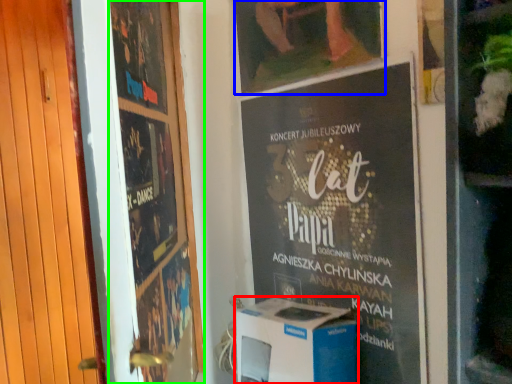
Question: Which object is positioned closest to appliance (highlighted by a red box)? Select from picture frame (highlighted by a blue box) and poster (highlighted by a green box).

Choices:
 (A) picture frame
 (B) poster

Answer: (B)